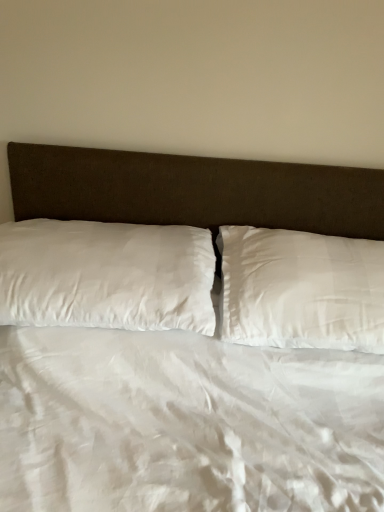
Question: Based on their sizes in the image, would you say white satin pillow at left, arranged as the 1th pillow when viewed from the left, is bigger or smaller than white satin pillow at center, placed as the 1th pillow when sorted from right to left?

Choices:
 (A) small
 (B) big

Answer: (B)

Question: Is point (129, 262) positioned closer to the camera than point (357, 294)?

Choices:
 (A) farther
 (B) closer

Answer: (B)

Question: From the image's perspective, is white satin pillow at left, arranged as the 1th pillow when viewed from the left, above or below white satin pillow at center, placed as the 1th pillow when sorted from right to left?

Choices:
 (A) above
 (B) below

Answer: (A)

Question: In the image, is white satin pillow at center, placed as the 1th pillow when sorted from right to left, positioned in front of or behind white satin pillow at left, which appears as the 2th pillow when viewed from the right?

Choices:
 (A) front
 (B) behind

Answer: (B)

Question: Is white satin pillow at center, placed as the 1th pillow when sorted from right to left, to the left or to the right of white satin pillow at left, which appears as the 2th pillow when viewed from the right, in the image?

Choices:
 (A) right
 (B) left

Answer: (A)

Question: From their relative heights in the image, would you say white satin pillow at center, positioned as the 2th pillow in left-to-right order, is taller or shorter than white satin pillow at left, which appears as the 2th pillow when viewed from the right?

Choices:
 (A) tall
 (B) short

Answer: (B)

Question: From the image's perspective, is white satin pillow at center, placed as the 1th pillow when sorted from right to left, above or below white satin pillow at left, arranged as the 1th pillow when viewed from the left?

Choices:
 (A) below
 (B) above

Answer: (A)